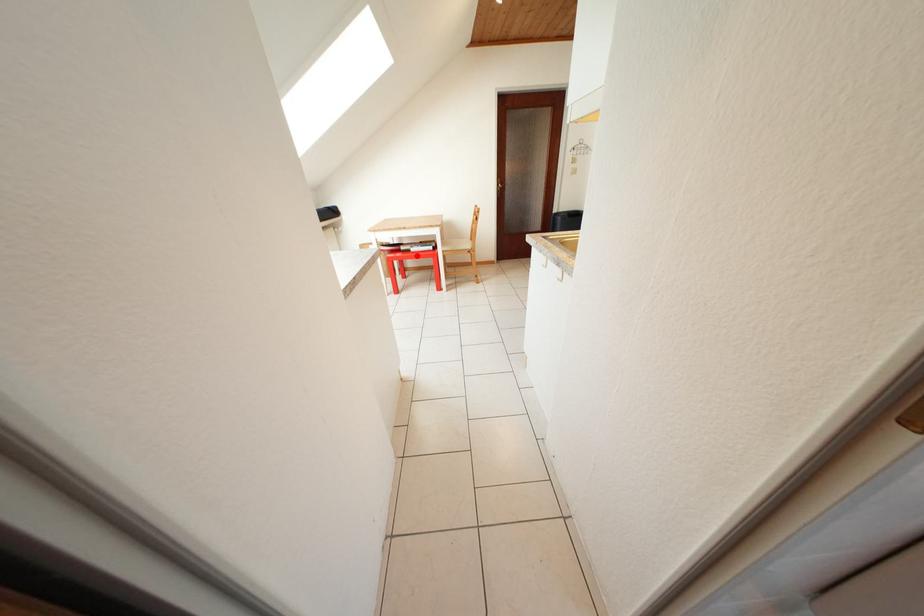
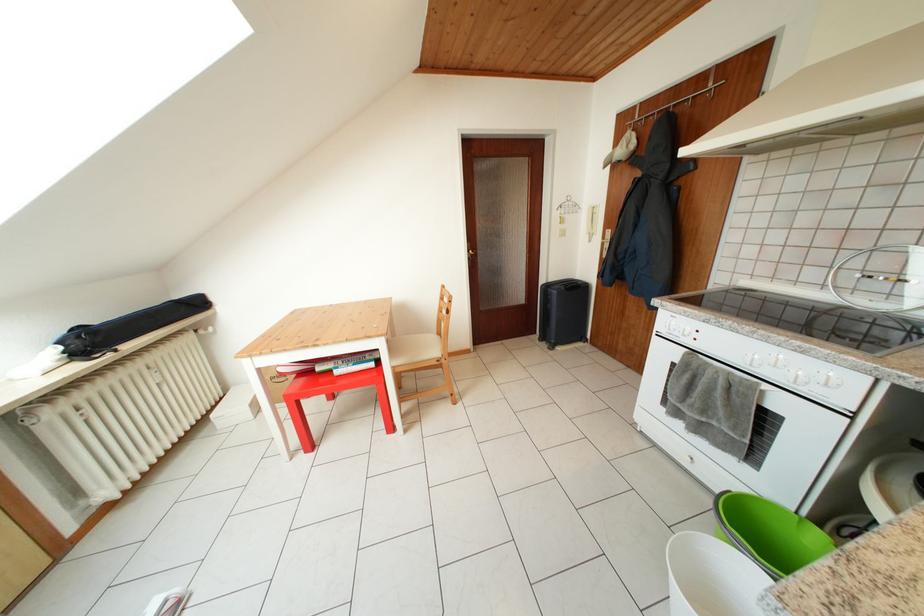
Question: I am providing you with two images of the same scene from different viewpoints. In image1, a red point is highlighted. Considering the same 3D point in image2, which of the following is correct?

Choices:
 (A) It is closer
 (B) It is farther

Answer: (B)